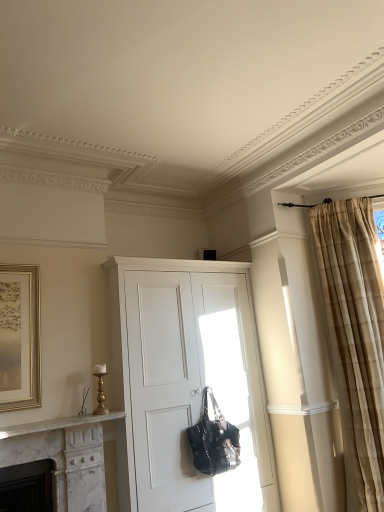
Question: Would you say beige textured curtain at right is a long distance from white matte cabinet at center?

Choices:
 (A) no
 (B) yes

Answer: (B)

Question: From the image's perspective, would you say beige textured curtain at right is shown under white matte cabinet at center?

Choices:
 (A) yes
 (B) no

Answer: (B)

Question: Can you confirm if beige textured curtain at right is positioned to the right of white matte cabinet at center?

Choices:
 (A) no
 (B) yes

Answer: (B)

Question: From a real-world perspective, is beige textured curtain at right positioned under white matte cabinet at center based on gravity?

Choices:
 (A) yes
 (B) no

Answer: (B)

Question: Considering the relative sizes of beige textured curtain at right and white matte cabinet at center in the image provided, is beige textured curtain at right taller than white matte cabinet at center?

Choices:
 (A) yes
 (B) no

Answer: (B)

Question: Would you say white matte cabinet at center is to the left or to the right of beige textured curtain at right in the picture?

Choices:
 (A) left
 (B) right

Answer: (A)

Question: From a real-world perspective, relative to beige textured curtain at right, is white matte cabinet at center vertically above or below?

Choices:
 (A) above
 (B) below

Answer: (B)

Question: Is white matte cabinet at center spatially inside beige textured curtain at right, or outside of it?

Choices:
 (A) outside
 (B) inside

Answer: (A)

Question: From the image's perspective, relative to beige textured curtain at right, is white matte cabinet at center above or below?

Choices:
 (A) below
 (B) above

Answer: (A)

Question: Considering the positions of beige textured curtain at right and white matte cabinet at center in the image, is beige textured curtain at right taller or shorter than white matte cabinet at center?

Choices:
 (A) tall
 (B) short

Answer: (B)

Question: Considering the positions of point (312, 227) and point (122, 312), is point (312, 227) closer or farther from the camera than point (122, 312)?

Choices:
 (A) closer
 (B) farther

Answer: (B)

Question: From the image's perspective, is beige textured curtain at right positioned above or below white matte cabinet at center?

Choices:
 (A) above
 (B) below

Answer: (A)

Question: Based on their sizes in the image, would you say beige textured curtain at right is bigger or smaller than white matte cabinet at center?

Choices:
 (A) small
 (B) big

Answer: (A)

Question: Is beige textured curtain at right bigger or smaller than black leather handbag at center?

Choices:
 (A) big
 (B) small

Answer: (A)

Question: Is beige textured curtain at right wider or thinner than black leather handbag at center?

Choices:
 (A) thin
 (B) wide

Answer: (B)